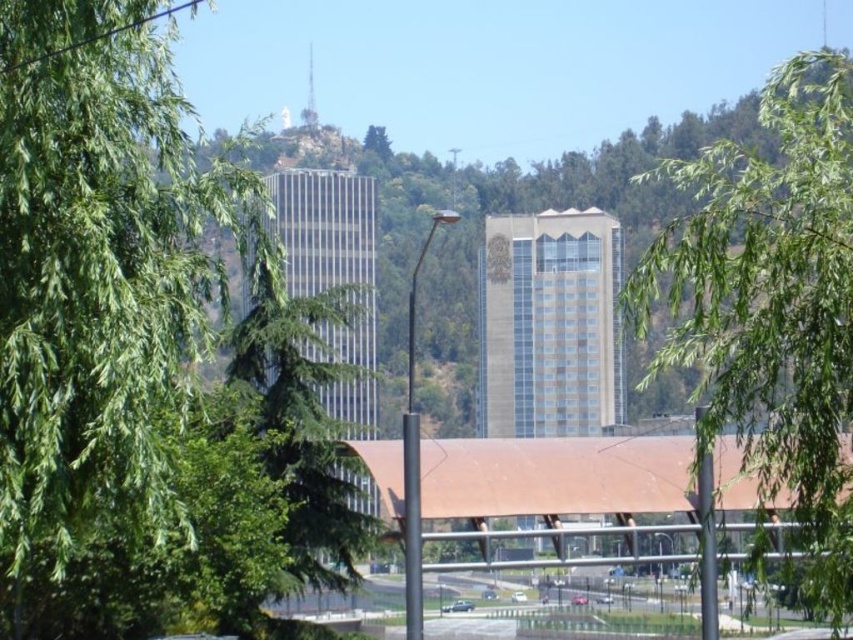
Question: Can you confirm if green leafy tree at left is positioned to the right of white glossy car at center?

Choices:
 (A) no
 (B) yes

Answer: (A)

Question: Which point appears farthest from the camera in this image?

Choices:
 (A) (514, 596)
 (B) (22, 282)

Answer: (A)

Question: Does green leafy tree at center have a smaller size compared to metallic silver car at center?

Choices:
 (A) no
 (B) yes

Answer: (A)

Question: Which point is farther to the camera?

Choices:
 (A) (7, 614)
 (B) (517, 598)

Answer: (B)

Question: Which object appears farthest from the camera in this image?

Choices:
 (A) green leafy tree at center
 (B) green leafy tree at left
 (C) metallic silver car at center
 (D) white glossy car at center

Answer: (D)

Question: Is metallic silver car at center to the left of white glossy car at center from the viewer's perspective?

Choices:
 (A) no
 (B) yes

Answer: (B)